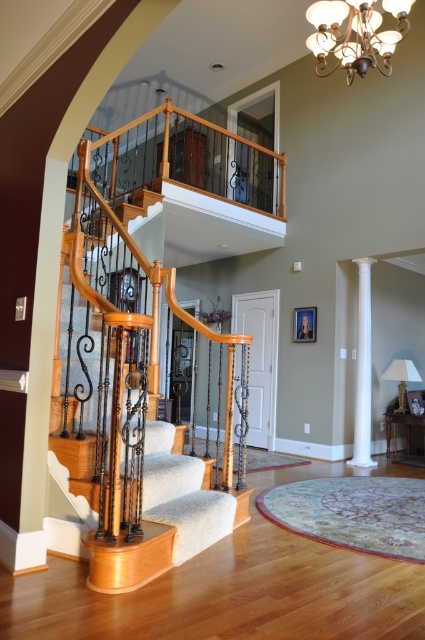
Question: Is matte gold chandelier at upper center wider than white smooth column at right?

Choices:
 (A) yes
 (B) no

Answer: (A)

Question: Does wooden staircase with carpeted steps at left appear on the left side of matte gold chandelier at upper center?

Choices:
 (A) no
 (B) yes

Answer: (B)

Question: Which point is farther from the camera taking this photo?

Choices:
 (A) (359, 419)
 (B) (334, 49)
 (C) (138, 282)

Answer: (A)

Question: Is wooden staircase with carpeted steps at left wider than white smooth column at right?

Choices:
 (A) yes
 (B) no

Answer: (A)

Question: Which of the following is the closest to the observer?

Choices:
 (A) (357, 388)
 (B) (328, 28)
 (C) (161, 536)

Answer: (C)

Question: Which of the following is the farthest from the observer?

Choices:
 (A) wooden staircase with carpeted steps at left
 (B) matte gold chandelier at upper center

Answer: (B)